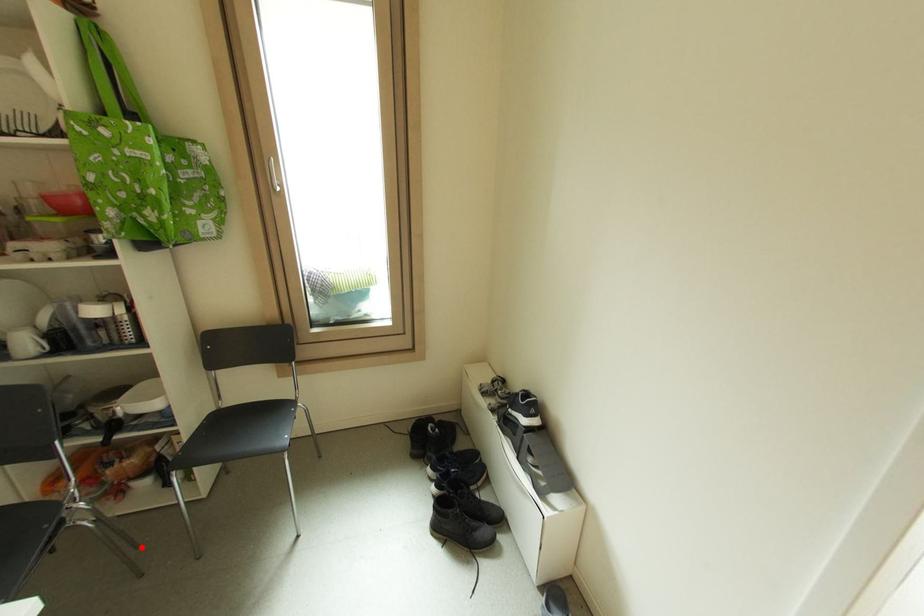
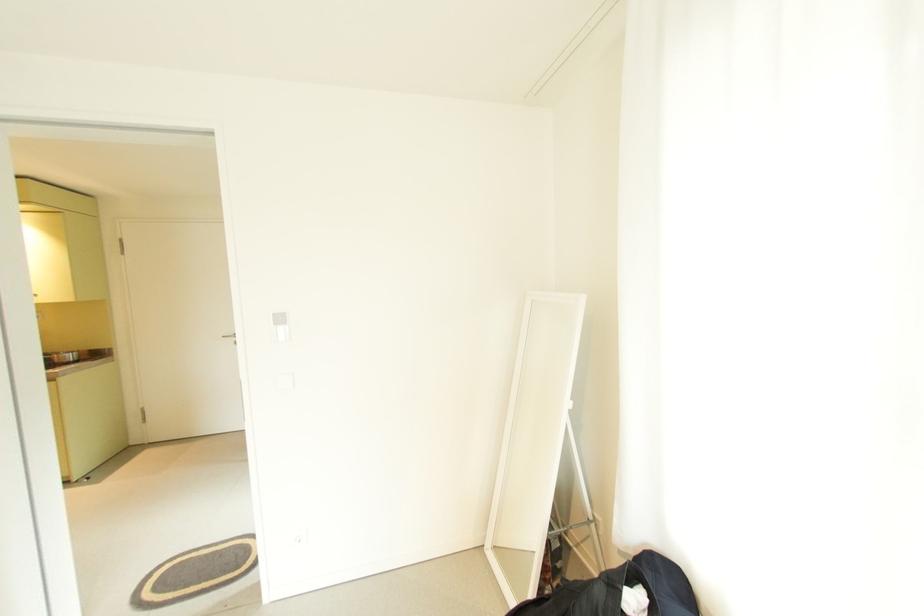
Question: I am providing you with two images of the same scene from different viewpoints. A red point is marked on the first image. At the location where the point appears in image 1, is it still visible in image 2?

Choices:
 (A) Yes
 (B) No

Answer: (B)